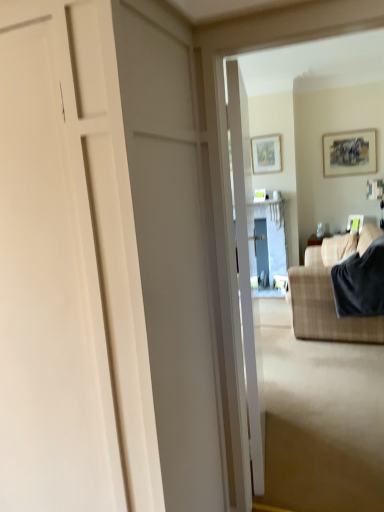
Question: Considering the positions of white matte door at center, the 1th door in the left-to-right sequence, and dark gray fabric at right in the image, is white matte door at center, the 1th door in the left-to-right sequence, bigger or smaller than dark gray fabric at right?

Choices:
 (A) small
 (B) big

Answer: (B)

Question: In terms of width, does white matte door at center, the 2th door from the right, look wider or thinner when compared to dark gray fabric at right?

Choices:
 (A) thin
 (B) wide

Answer: (B)

Question: Estimate the real-world distances between objects in this image. Which object is closer to the white glossy door at center, which is the 1th door from right to left?

Choices:
 (A) matte wooden picture frame at upper center, which appears as the 3th picture frame when ordered from the bottom
 (B) matte white picture frame at upper right, positioned as the third picture frame in top-to-bottom order
 (C) plaid fabric couch at right
 (D) matte wooden picture frame at upper right, the 2th picture frame when ordered from right to left
 (E) white matte door at center, the 1th door in the left-to-right sequence

Answer: (E)

Question: Estimate the real-world distances between objects in this image. Which object is closer to the plaid fabric couch at right?

Choices:
 (A) dark gray fabric at right
 (B) white glossy door at center, which ranks as the 2th door in left-to-right order
 (C) matte wooden picture frame at upper right, which appears as the second picture frame when viewed from the left
 (D) white matte door at center, the 2th door from the right
 (E) matte wooden picture frame at upper center, acting as the 3th picture frame starting from the right

Answer: (A)